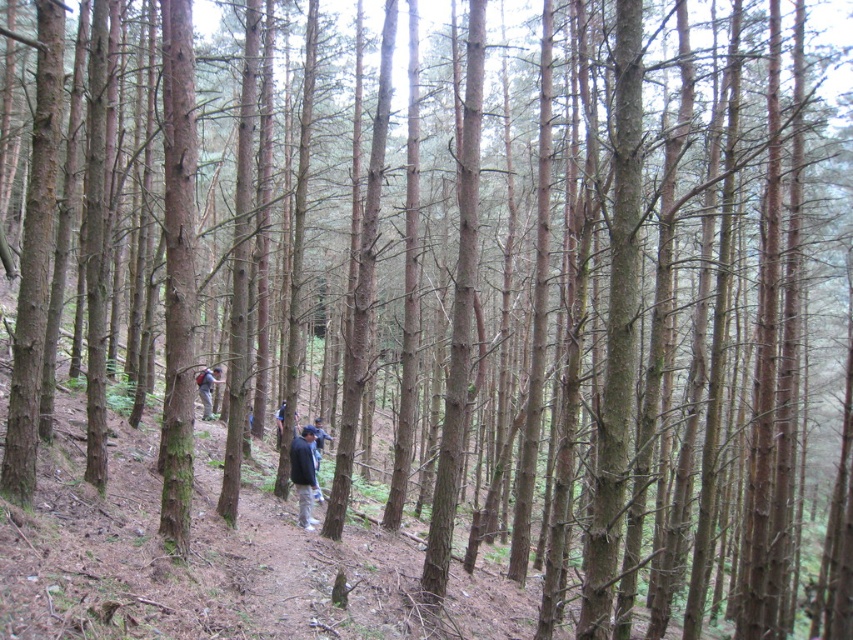
You are a hiker navigating a narrow dirt path in a dense forest. You notice two points marked on the path ahead of you. The first point is at coordinates point (300, 435) and the second is at point (213, 369). Which point should you reach first while moving forward along the path?

You will reach point (300, 435) first because it is closer to you than point (213, 369).